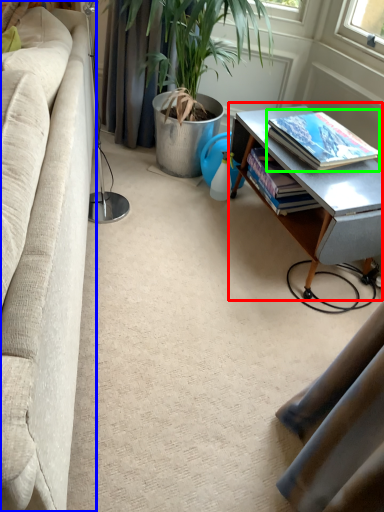
Question: Based on their relative distances, which object is farther from table (highlighted by a red box)? Choose from studio couch (highlighted by a blue box) and book (highlighted by a green box).

Choices:
 (A) studio couch
 (B) book

Answer: (A)